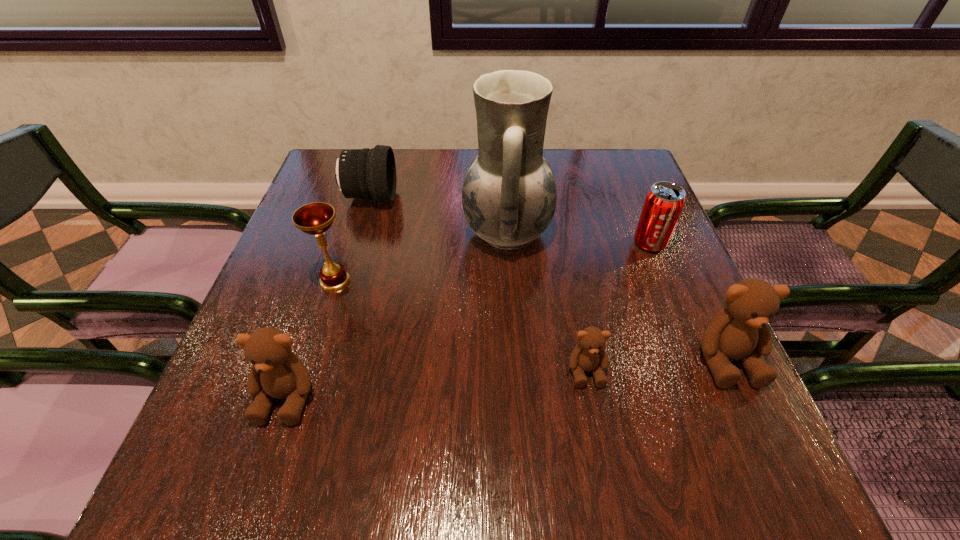
The image size is (960, 540). I want to click on the second tallest teddy bear, so click(x=277, y=372).

You are a GUI agent. You are given a task and a screenshot of the screen. Output one action in this format:
    pyautogui.click(x=<x>, y=<y>)
    Task: Click on the shortest object
    
    Given the screenshot: What is the action you would take?
    pyautogui.click(x=589, y=355)

Where is `the second teddy bear from right to left`? This screenshot has height=540, width=960. the second teddy bear from right to left is located at coordinates (589, 355).

This screenshot has height=540, width=960. Find the location of `the rightmost teddy bear`. the rightmost teddy bear is located at coordinates (740, 332).

You are a GUI agent. You are given a task and a screenshot of the screen. Output one action in this format:
    pyautogui.click(x=<x>, y=<y>)
    Task: Click on the telephoto lens
    The image size is (960, 540).
    Given the screenshot: What is the action you would take?
    pyautogui.click(x=366, y=173)

At what (x,y) coordinates should I click in order to perform the action: click on chalice. Please return your answer as a coordinate pair (x, y). The height and width of the screenshot is (540, 960). Looking at the image, I should click on (316, 218).

Where is `pitcher`? This screenshot has height=540, width=960. pitcher is located at coordinates (509, 196).

Locate an element on the screen. soda can is located at coordinates (664, 202).

Locate an element on the screen. vacant space located 0.060m on the face of the second teddy bear from right to left is located at coordinates (596, 422).

Identify the location of free spot located at the front element of the telephoto lens. (478, 198).